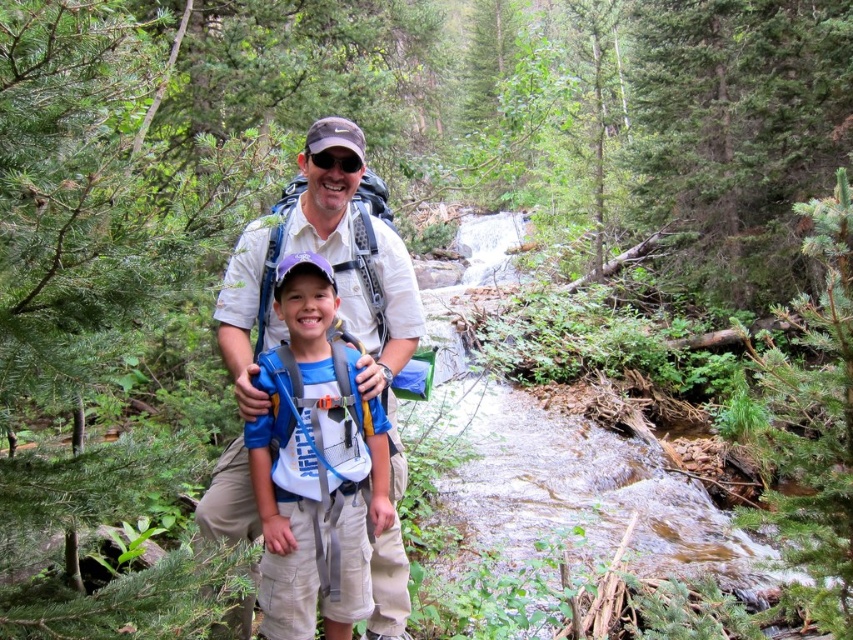
Describe the element at coordinates (334, 275) in the screenshot. The image size is (853, 640). I see `light beige cotton shirt at center` at that location.

Between light beige cotton shirt at center and black matte sunglasses at center, which one has less height?

black matte sunglasses at center is shorter.

Describe the element at coordinates (334, 275) in the screenshot. The width and height of the screenshot is (853, 640). I see `light beige cotton shirt at center` at that location.

Where is `light beige cotton shirt at center`? The height and width of the screenshot is (640, 853). light beige cotton shirt at center is located at coordinates (334, 275).

Can you confirm if light beige cotton shirt at center is wider than blue fabric backpack at center?

Yes.

Does point (236, 464) come in front of point (383, 512)?

That is False.

Is point (407, 301) positioned behind point (317, 330)?

Yes, it is behind point (317, 330).

Locate an element on the screen. The width and height of the screenshot is (853, 640). light beige cotton shirt at center is located at coordinates (334, 275).

Does blue fabric backpack at center appear on the right side of black matte sunglasses at center?

No, blue fabric backpack at center is not to the right of black matte sunglasses at center.

Measure the distance between blue fabric backpack at center and black matte sunglasses at center.

blue fabric backpack at center and black matte sunglasses at center are 1.05 meters apart.

Which is in front, point (276, 278) or point (322, 161)?

Positioned in front is point (276, 278).

Identify the location of blue fabric backpack at center. This screenshot has width=853, height=640. (315, 465).